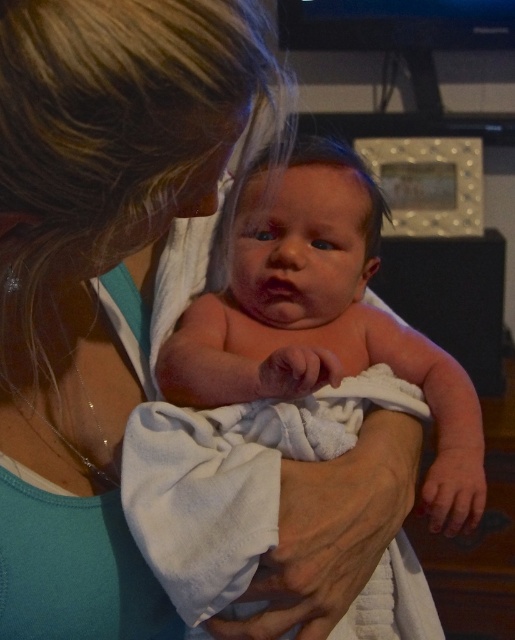
Does blue fabric at center appear on the left side of pink soft towel at center?

Yes, blue fabric at center is to the left of pink soft towel at center.

Does blue fabric at center come in front of pink soft towel at center?

Yes, blue fabric at center is in front of pink soft towel at center.

Is point (159, 236) behind point (323, 456)?

That is False.

Where is `blue fabric at center`? This screenshot has width=515, height=640. blue fabric at center is located at coordinates (95, 273).